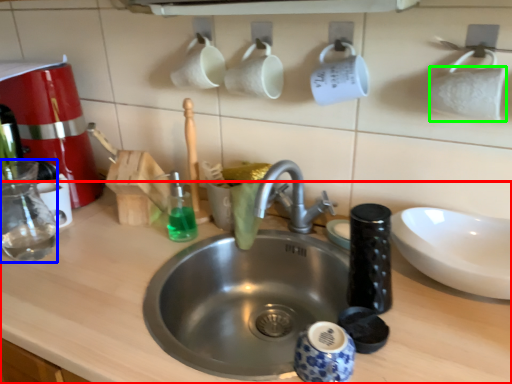
Question: Based on their relative distances, which object is farther from counter top (highlighted by a red box)? Choose from bottle (highlighted by a blue box) and toilet paper (highlighted by a green box).

Choices:
 (A) bottle
 (B) toilet paper

Answer: (B)